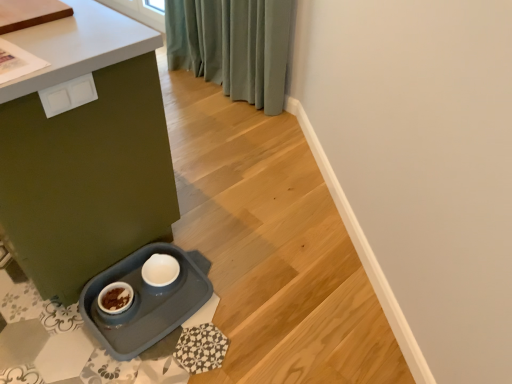
Question: Is white plastic drawer at upper left outside matte gray tray at lower left?

Choices:
 (A) yes
 (B) no

Answer: (B)

Question: Is white plastic drawer at upper left oriented away from matte gray tray at lower left?

Choices:
 (A) no
 (B) yes

Answer: (B)

Question: Can you confirm if white plastic drawer at upper left is positioned to the right of matte gray tray at lower left?

Choices:
 (A) no
 (B) yes

Answer: (B)

Question: From a real-world perspective, is white plastic drawer at upper left positioned under matte gray tray at lower left based on gravity?

Choices:
 (A) no
 (B) yes

Answer: (A)

Question: From a real-world perspective, is white plastic drawer at upper left positioned over matte gray tray at lower left based on gravity?

Choices:
 (A) no
 (B) yes

Answer: (B)

Question: Considering the relative sizes of white plastic drawer at upper left and matte gray tray at lower left in the image provided, is white plastic drawer at upper left thinner than matte gray tray at lower left?

Choices:
 (A) yes
 (B) no

Answer: (A)

Question: Can you confirm if matte gray tray at lower left is taller than white plastic drawer at upper left?

Choices:
 (A) no
 (B) yes

Answer: (B)

Question: Is matte gray tray at lower left positioned with its back to white plastic drawer at upper left?

Choices:
 (A) no
 (B) yes

Answer: (A)

Question: Would you say white plastic drawer at upper left is part of matte gray tray at lower left's contents?

Choices:
 (A) no
 (B) yes

Answer: (B)

Question: From a real-world perspective, is matte gray tray at lower left positioned under white plastic drawer at upper left based on gravity?

Choices:
 (A) no
 (B) yes

Answer: (B)

Question: Is matte gray tray at lower left outside white plastic drawer at upper left?

Choices:
 (A) yes
 (B) no

Answer: (A)

Question: Is matte gray tray at lower left at the left side of white plastic drawer at upper left?

Choices:
 (A) yes
 (B) no

Answer: (A)

Question: From a real-world perspective, is white plastic drawer at upper left physically located above or below matte gray tray at lower left?

Choices:
 (A) above
 (B) below

Answer: (A)